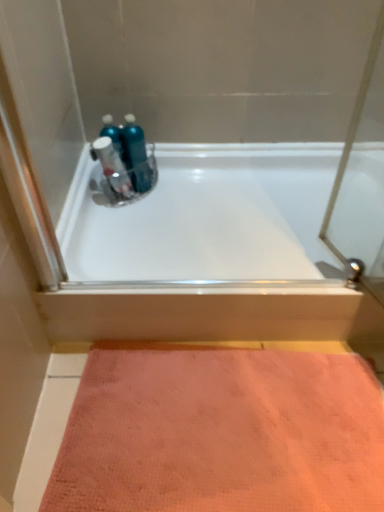
Question: Considering the positions of point coord(61,458) and point coord(261,195), is point coord(61,458) closer or farther from the camera than point coord(261,195)?

Choices:
 (A) farther
 (B) closer

Answer: (B)

Question: From the image's perspective, is pink textured mat at lower center positioned above or below white glossy bathtub at upper center?

Choices:
 (A) above
 (B) below

Answer: (B)

Question: Based on their relative distances, which object is nearer to the blue glossy mouthwash at center?

Choices:
 (A) metallic blue spray bottle at upper center
 (B) white glossy bathtub at upper center
 (C) pink textured mat at lower center

Answer: (A)

Question: Which of these objects is positioned farthest from the blue glossy mouthwash at center?

Choices:
 (A) white glossy bathtub at upper center
 (B) pink textured mat at lower center
 (C) metallic blue spray bottle at upper center

Answer: (B)